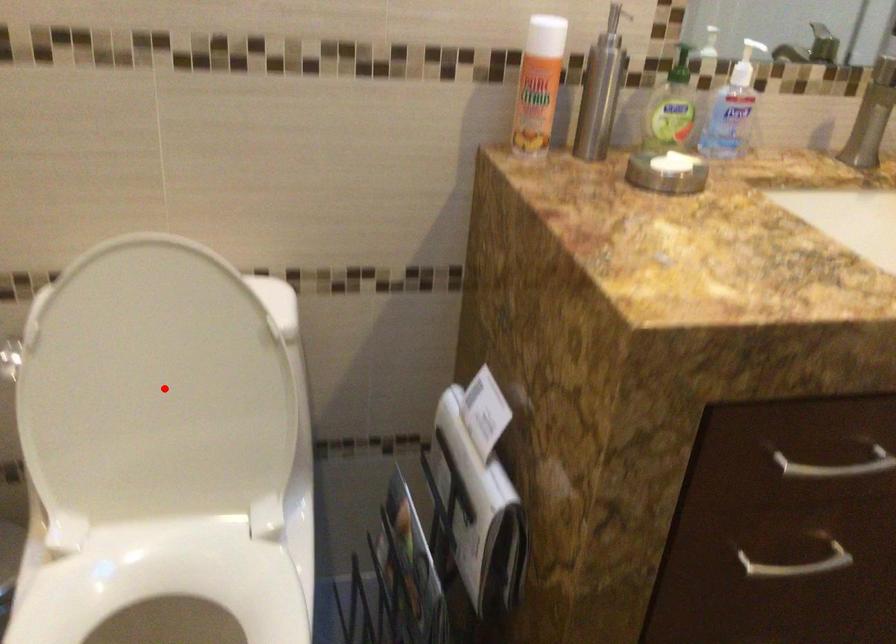
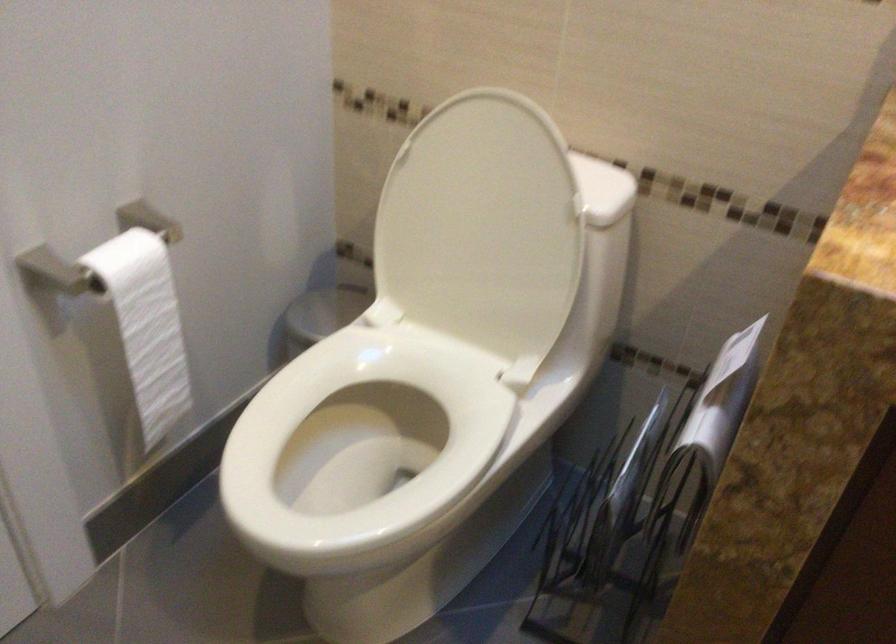
Question: I am providing you with two images of the same scene from different viewpoints. In image1, a red point is highlighted. Considering the same 3D point in image2, which of the following is correct?

Choices:
 (A) It is closer
 (B) It is farther

Answer: (B)